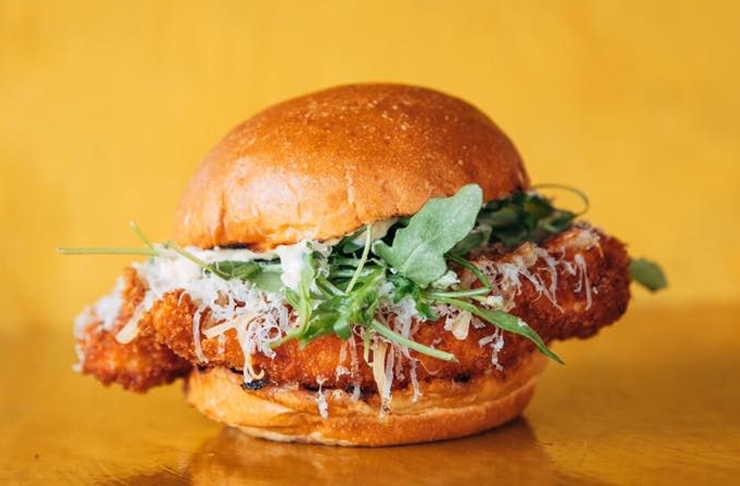
Identify the location of wall. The image size is (740, 486). (638, 204).